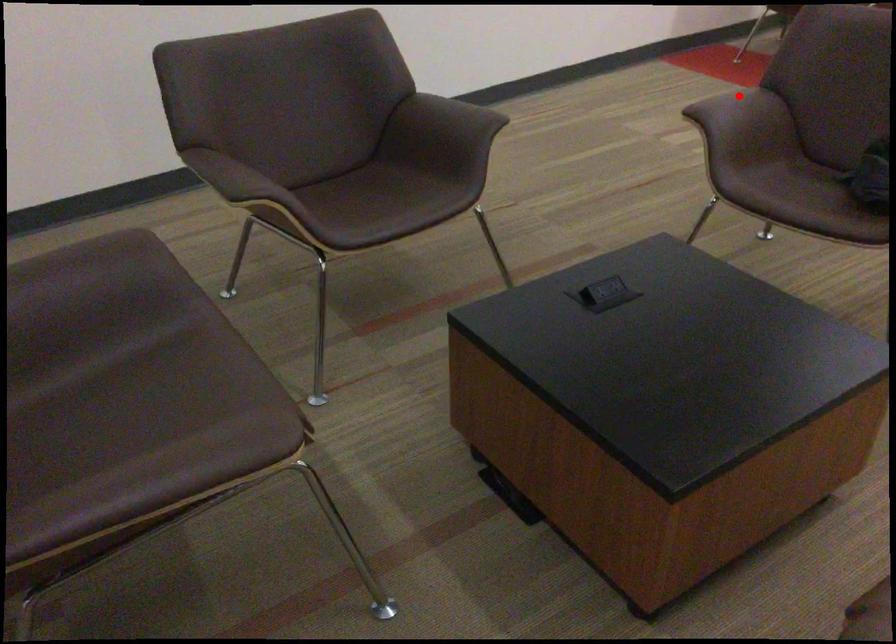
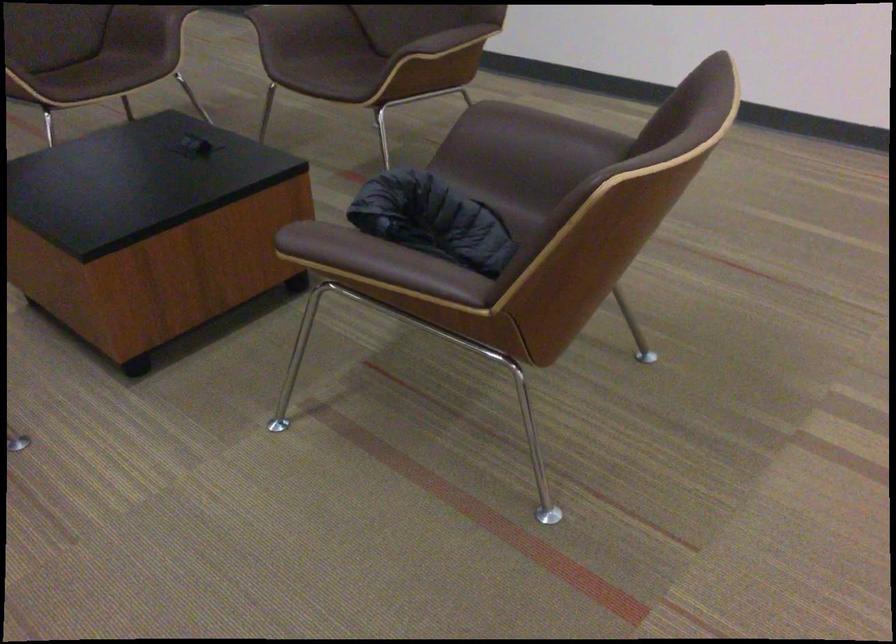
Question: I am providing you with two images of the same scene from different viewpoints. Image1 has a red point marked. In image2, the corresponding 3D location appears at what relative position? Reply with the corresponding letter.

Choices:
 (A) Closer
 (B) Farther

Answer: (A)